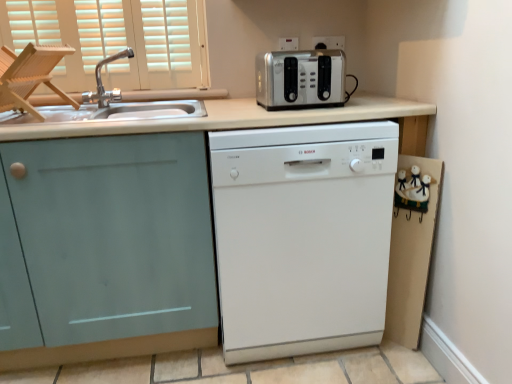
Question: Considering the relative sizes of wooden folding chair at left and metallic silver outlet at upper center, which is the second electric outlet from left to right, in the image provided, is wooden folding chair at left thinner than metallic silver outlet at upper center, which is the second electric outlet from left to right,?

Choices:
 (A) no
 (B) yes

Answer: (A)

Question: Are wooden folding chair at left and metallic silver outlet at upper center, the first electric outlet positioned from the right, beside each other?

Choices:
 (A) no
 (B) yes

Answer: (A)

Question: From a real-world perspective, is wooden folding chair at left over metallic silver outlet at upper center, which is the second electric outlet from left to right?

Choices:
 (A) no
 (B) yes

Answer: (A)

Question: Considering the relative sizes of wooden folding chair at left and metallic silver outlet at upper center, the first electric outlet positioned from the right, in the image provided, is wooden folding chair at left smaller than metallic silver outlet at upper center, the first electric outlet positioned from the right,?

Choices:
 (A) no
 (B) yes

Answer: (A)

Question: Considering the relative positions of wooden folding chair at left and metallic silver outlet at upper center, which is the second electric outlet from left to right, in the image provided, is wooden folding chair at left to the right of metallic silver outlet at upper center, which is the second electric outlet from left to right, from the viewer's perspective?

Choices:
 (A) yes
 (B) no

Answer: (B)

Question: Based on their positions, is satin silver toaster at upper center located to the left or right of white glossy dishwasher at center?

Choices:
 (A) left
 (B) right

Answer: (A)

Question: In terms of size, does satin silver toaster at upper center appear bigger or smaller than white glossy dishwasher at center?

Choices:
 (A) big
 (B) small

Answer: (B)

Question: In the image, is satin silver toaster at upper center positioned in front of or behind white glossy dishwasher at center?

Choices:
 (A) behind
 (B) front

Answer: (A)

Question: Looking at their shapes, would you say satin silver toaster at upper center is wider or thinner than white glossy dishwasher at center?

Choices:
 (A) wide
 (B) thin

Answer: (B)

Question: Would you say white glossy dishwasher at center is inside or outside metallic silver outlet at upper center, the first electric outlet positioned from the right?

Choices:
 (A) outside
 (B) inside

Answer: (A)

Question: In terms of height, does white glossy dishwasher at center look taller or shorter compared to metallic silver outlet at upper center, the first electric outlet positioned from the right?

Choices:
 (A) tall
 (B) short

Answer: (A)

Question: Considering the positions of white glossy dishwasher at center and metallic silver outlet at upper center, the first electric outlet positioned from the right, in the image, is white glossy dishwasher at center bigger or smaller than metallic silver outlet at upper center, the first electric outlet positioned from the right,?

Choices:
 (A) small
 (B) big

Answer: (B)

Question: Considering their positions, is white glossy dishwasher at center located in front of or behind metallic silver outlet at upper center, the first electric outlet positioned from the right?

Choices:
 (A) front
 (B) behind

Answer: (A)

Question: Considering the positions of wooden folding chair at left and white glossy dishwasher at center in the image, is wooden folding chair at left bigger or smaller than white glossy dishwasher at center?

Choices:
 (A) big
 (B) small

Answer: (B)

Question: In terms of width, does wooden folding chair at left look wider or thinner when compared to white glossy dishwasher at center?

Choices:
 (A) thin
 (B) wide

Answer: (A)